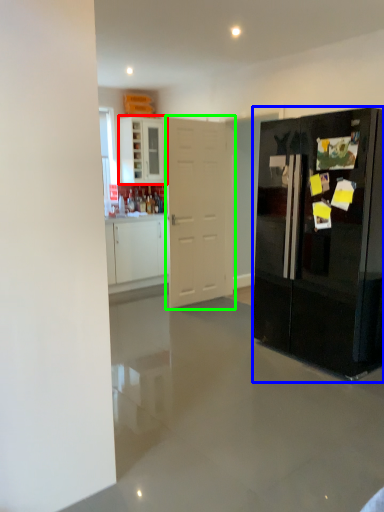
Question: Which is nearer to the cabinetry (highlighted by a red box)? refrigerator (highlighted by a blue box) or door (highlighted by a green box).

Choices:
 (A) refrigerator
 (B) door

Answer: (B)